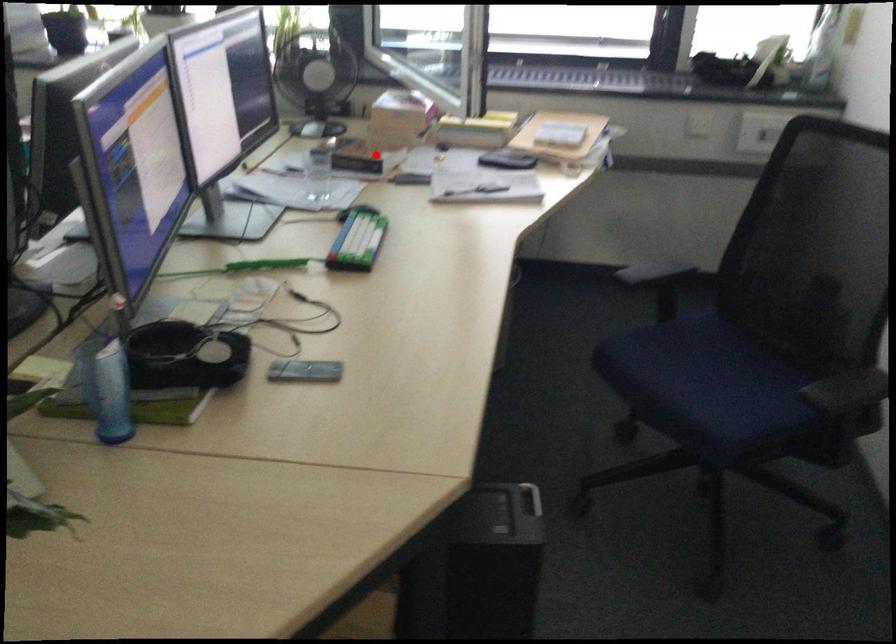
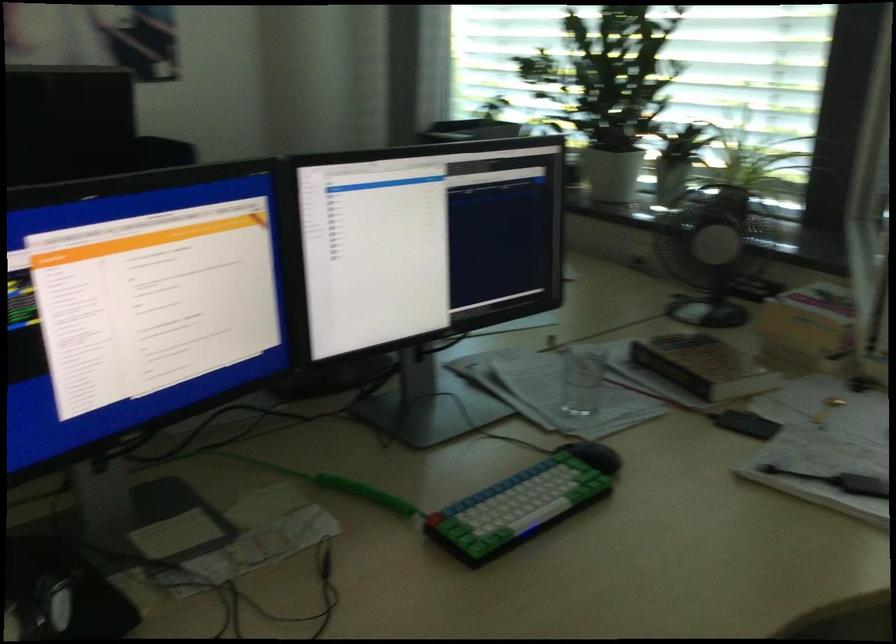
Question: I am providing you with two images of the same scene from different viewpoints. Given a red point in image1, look at the same physical point in image2. Is it:

Choices:
 (A) Closer to the viewpoint
 (B) Farther from the viewpoint

Answer: (A)